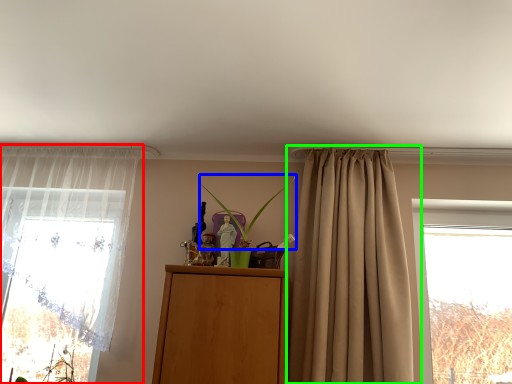
Question: Which object is the farthest from curtain (highlighted by a red box)? Choose among these: plant (highlighted by a blue box) or curtain (highlighted by a green box).

Choices:
 (A) plant
 (B) curtain

Answer: (B)